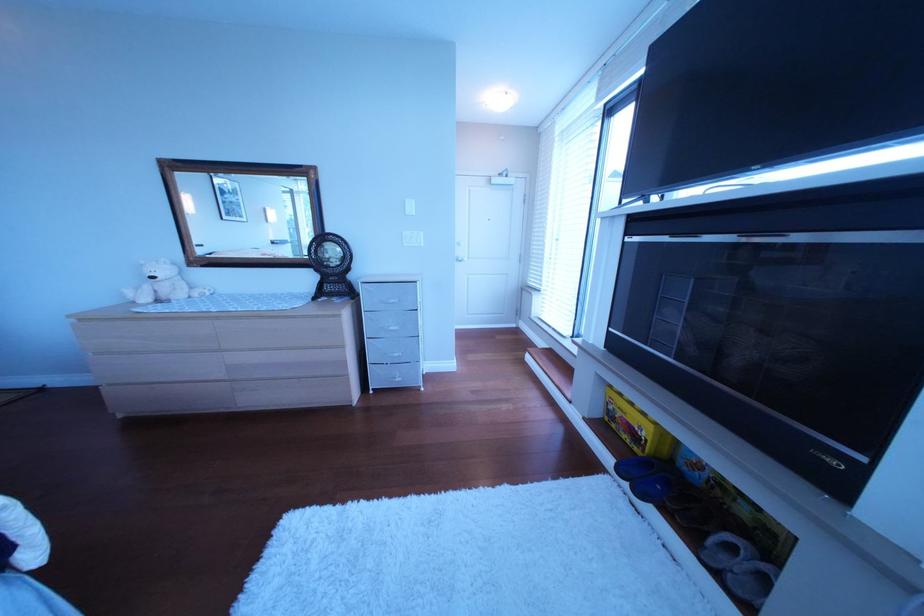
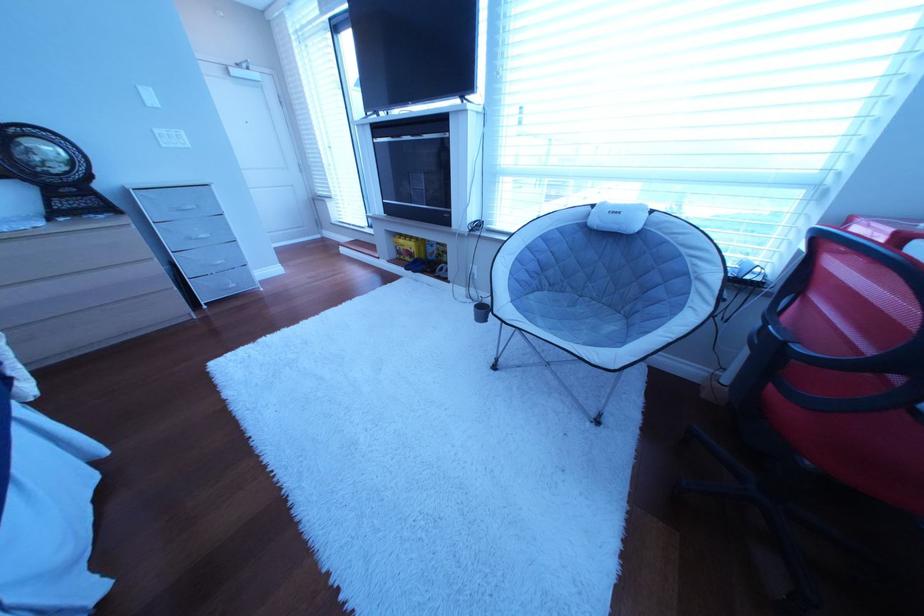
In the second image, find the point that corresponds to (399,305) in the first image.

(193, 213)